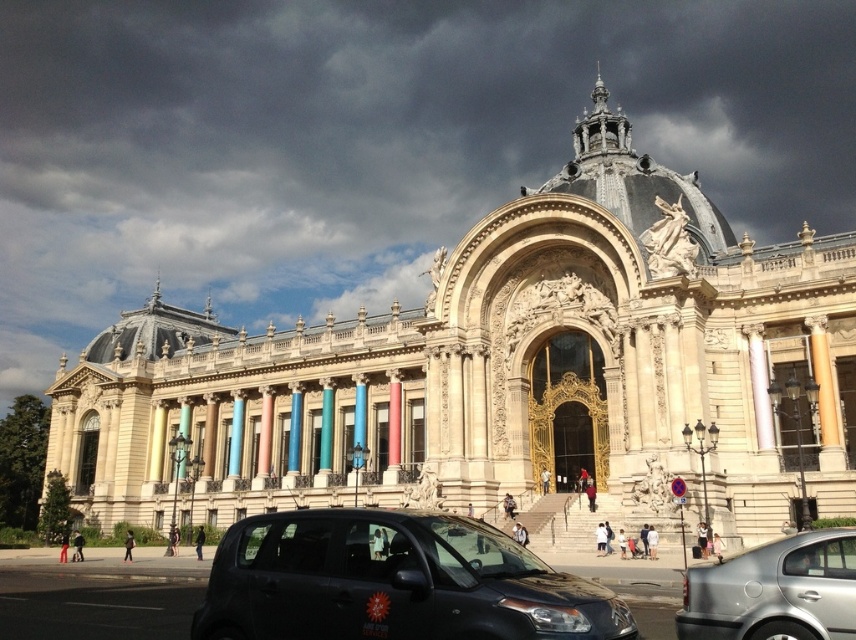
Image resolution: width=856 pixels, height=640 pixels. In order to click on black matte car at lower center in this screenshot , I will do `click(393, 580)`.

Does black matte car at lower center have a greater height compared to silver metallic sedan at lower right?

Yes, black matte car at lower center is taller than silver metallic sedan at lower right.

Find the location of a particular element. black matte car at lower center is located at coordinates (393, 580).